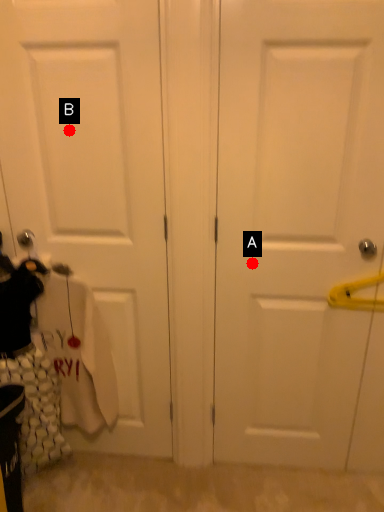
Question: Two points are circled on the image, labeled by A and B beside each circle. Which of the following is the closest to the observer?

Choices:
 (A) A is closer
 (B) B is closer

Answer: (B)